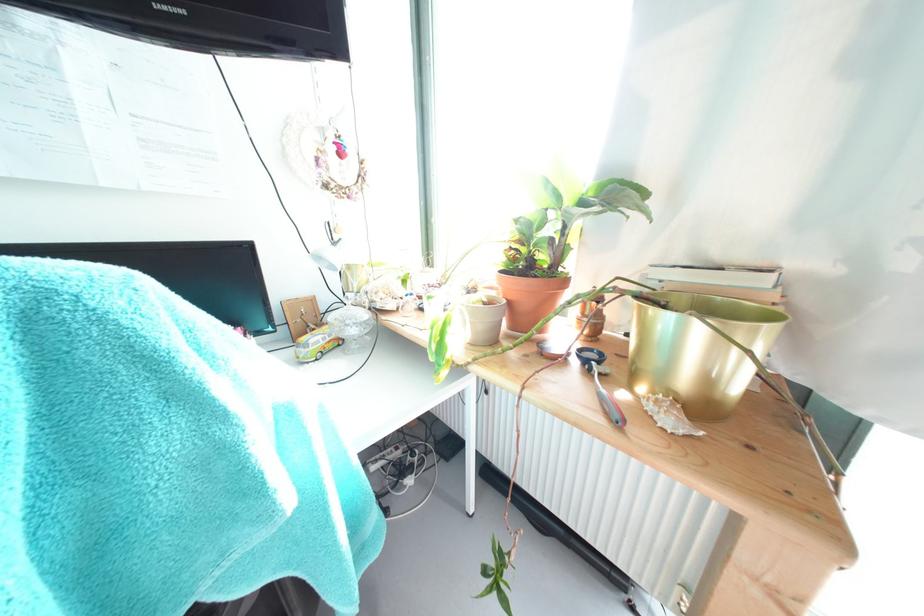
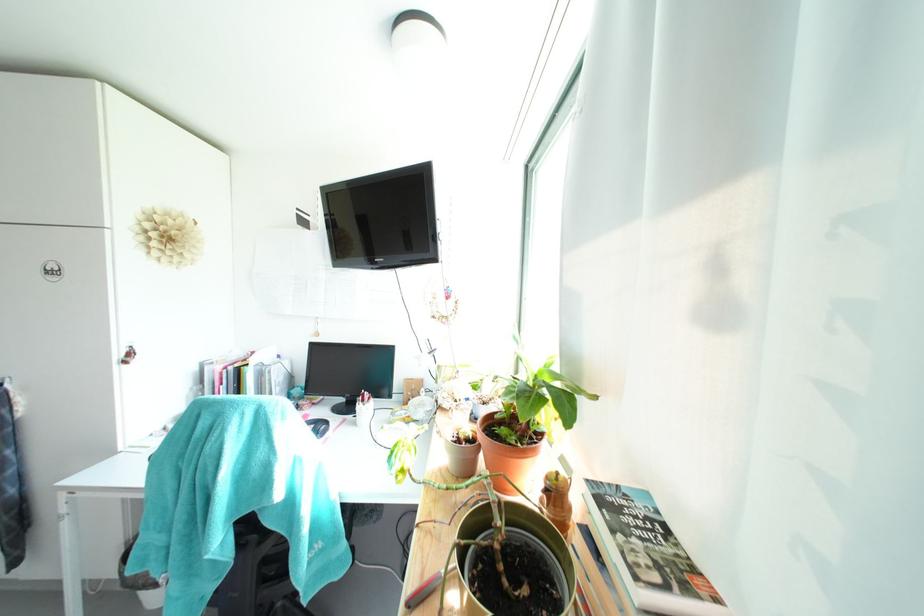
Question: The images are taken continuously from a first-person perspective. In which direction is your viewpoint rotating?

Choices:
 (A) Left
 (B) Right
 (C) Up
 (D) Down

Answer: (A)